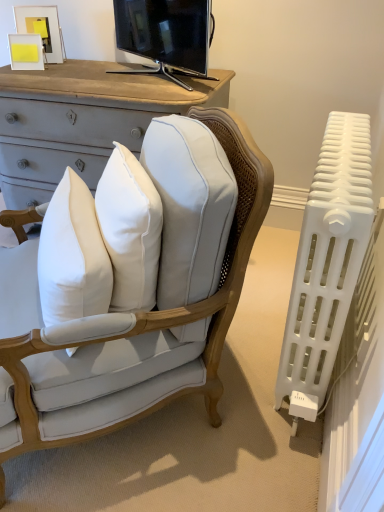
Question: Based on their positions, is white fabric chair at center located to the left or right of black glossy tv at upper center?

Choices:
 (A) right
 (B) left

Answer: (B)

Question: Would you say white fabric chair at center is inside or outside black glossy tv at upper center?

Choices:
 (A) outside
 (B) inside

Answer: (A)

Question: Which object is positioned closest to the matte yellow paper at upper left, the first picture frame when ordered from bottom to top?

Choices:
 (A) white cotton pillow at center
 (B) white fabric chair at center
 (C) white plastic radiator at right
 (D) matte white picture frame at upper left, the second picture frame positioned from the bottom
 (E) black glossy tv at upper center

Answer: (D)

Question: Considering the real-world distances, which object is farthest from the black glossy tv at upper center?

Choices:
 (A) matte yellow paper at upper left, the first picture frame when ordered from bottom to top
 (B) white fabric chair at center
 (C) white cotton pillow at center
 (D) matte white picture frame at upper left, the 1th picture frame positioned from the top
 (E) white plastic radiator at right

Answer: (B)